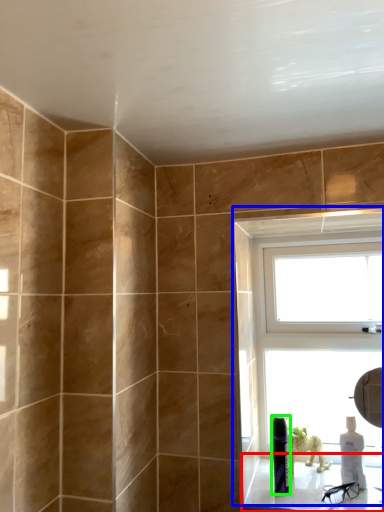
Question: Considering the real-world distances, which object is closest to window sill (highlighted by a red box)? window (highlighted by a blue box) or toiletry (highlighted by a green box).

Choices:
 (A) window
 (B) toiletry

Answer: (B)